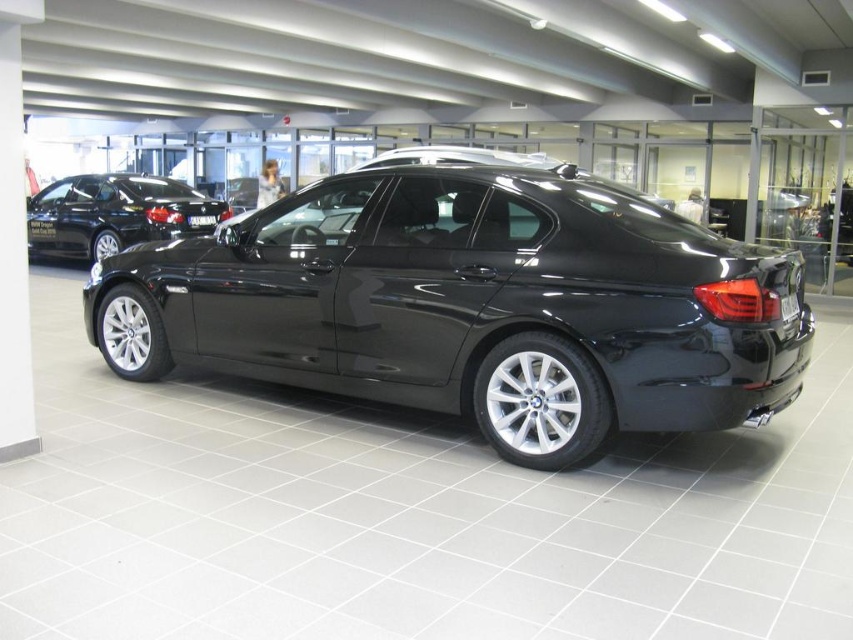
Is glossy black car at center wider than glossy black sedan at upper left?

Correct, the width of glossy black car at center exceeds that of glossy black sedan at upper left.

Is glossy black car at center bigger than glossy black sedan at upper left?

Yes, glossy black car at center is bigger than glossy black sedan at upper left.

Does point (119, 307) come closer to viewer compared to point (45, 230)?

Yes.

At what (x,y) coordinates should I click in order to perform the action: click on glossy black car at center. Please return your answer as a coordinate pair (x, y). The image size is (853, 640). Looking at the image, I should click on (473, 305).